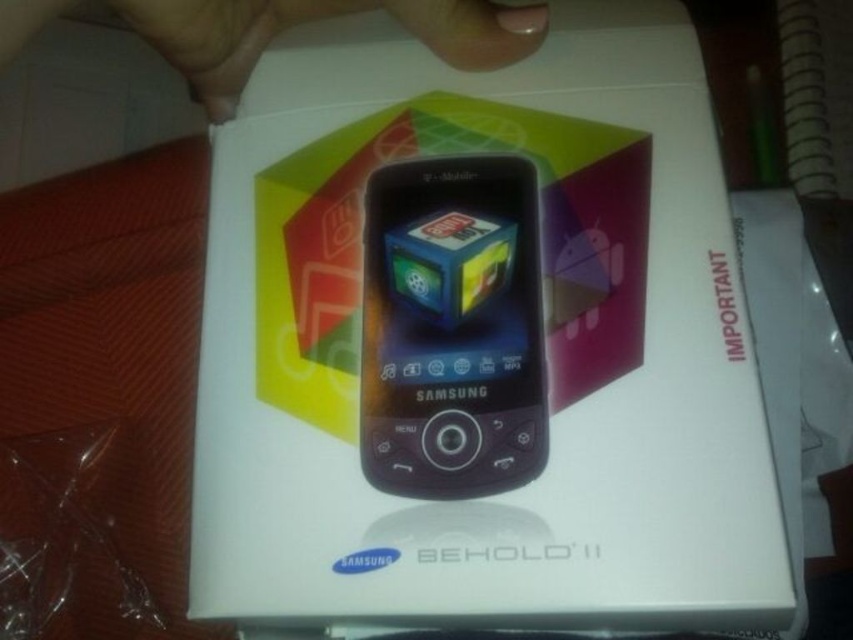
Question: Which object is farther from the camera taking this photo?

Choices:
 (A) nail polish at upper center
 (B) purple glossy smartphone at center
 (C) white matte box at center

Answer: (B)

Question: Is white matte box at center below purple glossy smartphone at center?

Choices:
 (A) yes
 (B) no

Answer: (B)

Question: Which of the following is the closest to the observer?

Choices:
 (A) white matte box at center
 (B) nail polish at upper center

Answer: (B)

Question: Does white matte box at center have a smaller size compared to nail polish at upper center?

Choices:
 (A) yes
 (B) no

Answer: (B)

Question: Where is purple glossy smartphone at center located in relation to nail polish at upper center in the image?

Choices:
 (A) below
 (B) above

Answer: (A)

Question: Which point is closer to the camera?

Choices:
 (A) purple glossy smartphone at center
 (B) white matte box at center

Answer: (B)